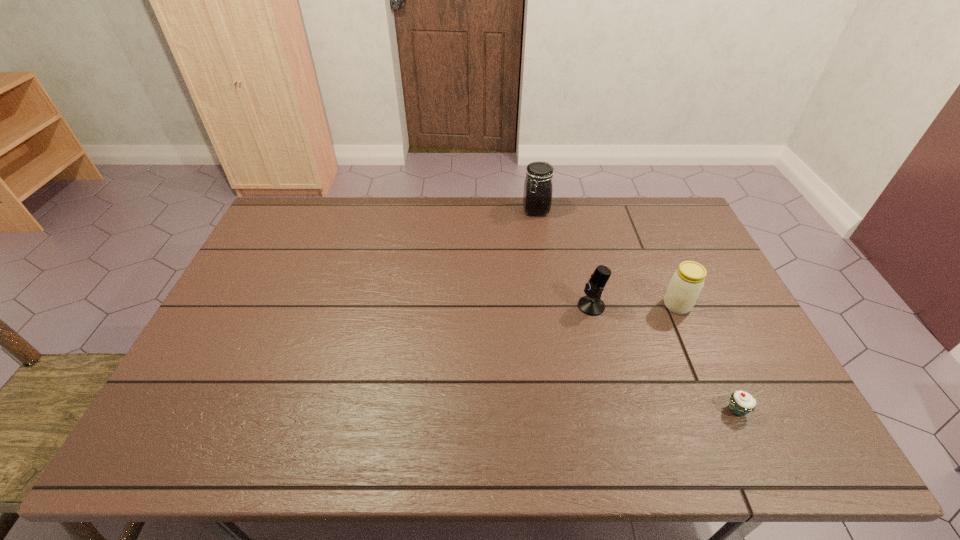
Identify the location of free point at the near left corner. This screenshot has height=540, width=960. (177, 439).

You are a GUI agent. You are given a task and a screenshot of the screen. Output one action in this format:
    pyautogui.click(x=<x>, y=<y>)
    Task: Click on the vacant area that lies between the left jar and the shortest object
    This screenshot has height=540, width=960.
    Given the screenshot: What is the action you would take?
    pyautogui.click(x=636, y=309)

At what (x,y) coordinates should I click in order to perform the action: click on free space between the nearer jar and the third object from right to left. Please return your answer as a coordinate pair (x, y). Looking at the image, I should click on (635, 306).

You are a GUI agent. You are given a task and a screenshot of the screen. Output one action in this format:
    pyautogui.click(x=<x>, y=<y>)
    Task: Click on the free space between the nearer jar and the farthest object
    Image resolution: width=960 pixels, height=540 pixels.
    Given the screenshot: What is the action you would take?
    pyautogui.click(x=607, y=258)

Locate an element on the screen. The height and width of the screenshot is (540, 960). free space between the second object from left to right and the cupcake is located at coordinates (664, 357).

The image size is (960, 540). Find the location of `vacant area between the second object from left to right and the nearest object`. vacant area between the second object from left to right and the nearest object is located at coordinates (664, 357).

Where is `free spot between the second object from left to right and the cupcake`? The width and height of the screenshot is (960, 540). free spot between the second object from left to right and the cupcake is located at coordinates point(664,357).

Find the location of `free point between the left jar and the microphone`. free point between the left jar and the microphone is located at coordinates (564, 258).

You are a GUI agent. You are given a task and a screenshot of the screen. Output one action in this format:
    pyautogui.click(x=<x>, y=<y>)
    Task: Click on the free space between the microphone and the shorter jar
    The image size is (960, 540).
    Given the screenshot: What is the action you would take?
    pyautogui.click(x=635, y=306)

At what (x,y) coordinates should I click in order to perform the action: click on vacant space in between the nearest object and the right jar. Please return your answer as a coordinate pair (x, y). The image size is (960, 540). Looking at the image, I should click on (707, 357).